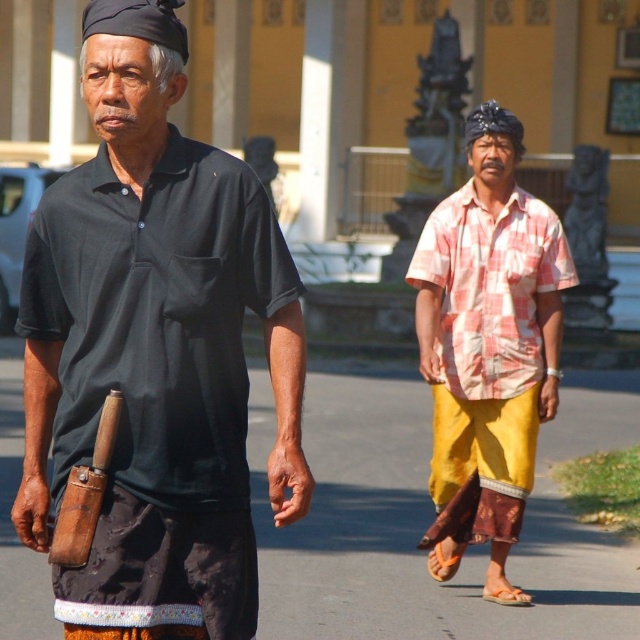
Is matte black shirt at center positioned before pink checkered shirt at right?

Yes.

Which is behind, point (234, 513) or point (481, 348)?

Point (481, 348)

What are the coordinates of `matte black shirt at center` in the screenshot? It's located at (154, 355).

In the scene shown: Which is more to the left, checkered fabric shirt at right or pink checkered shirt at right?

From the viewer's perspective, pink checkered shirt at right appears more on the left side.

Is point (509, 372) behind point (449, 358)?

No, (509, 372) is closer to viewer.

Where is `checkered fabric shirt at right`? This screenshot has height=640, width=640. checkered fabric shirt at right is located at coordinates (488, 342).

I want to click on checkered fabric shirt at right, so [x=488, y=342].

The height and width of the screenshot is (640, 640). What do you see at coordinates (154, 355) in the screenshot? I see `matte black shirt at center` at bounding box center [154, 355].

Does point (141, 65) come farther from viewer compared to point (458, 552)?

No.

Identify the location of matte black shirt at center. Image resolution: width=640 pixels, height=640 pixels. (154, 355).